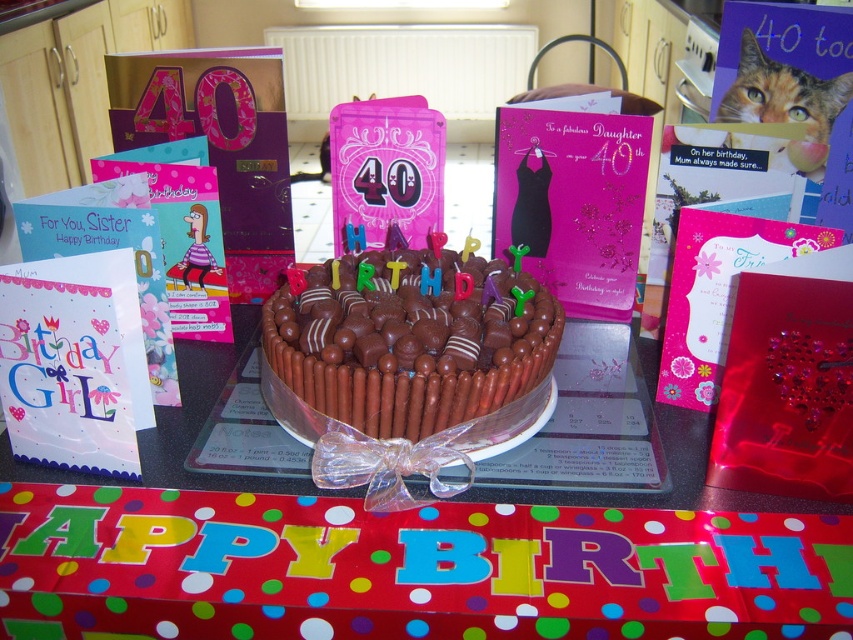
You are a photographer setting up for a birthday photo. You need to position the pink glittery dress at center and orange fur cat at upper right so that they are exactly 10 inches apart. Based on the current setup, do you need to move them closer or farther apart?

The current distance between the pink glittery dress at center and orange fur cat at upper right is 9.03 inches. To reach the desired 10 inches, you need to move them farther apart.

You are a photographer standing at a certain distance from the chocolate cake at center. You want to take a closeup shot of the cake without any distortion. The camera you are using has a minimum focusing distance of 40 centimeters. Can you take the photo as desired?

The distance of chocolate cake at center from camera is 50.08 centimeters, which is greater than the camera minimum focusing distance of 40 centimeters. Therefore, you can take the photo as desired without distortion.